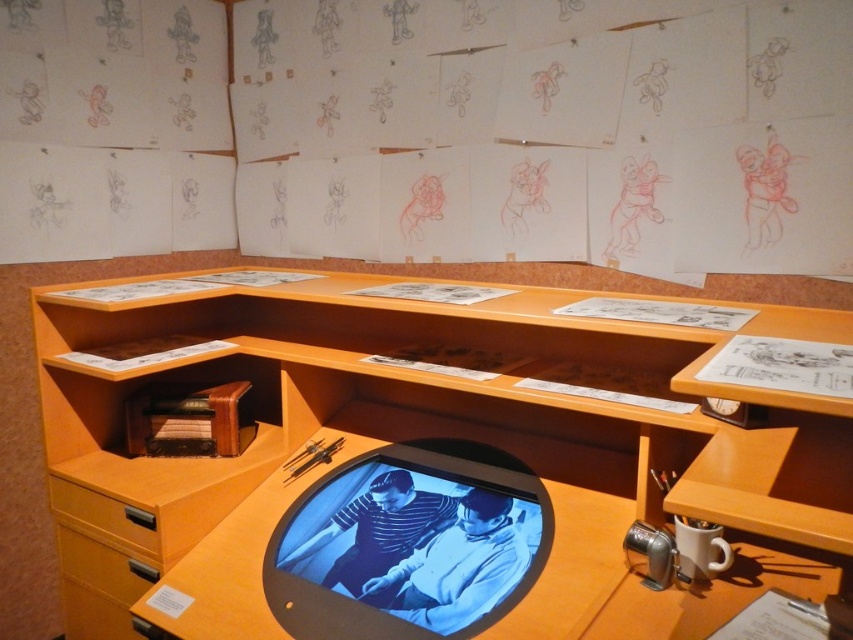
You are standing at the desk and need to reach both the point at coordinates point (392,492) and point (138,564). Which point is closer to you?

Point (392,492) is in front of point (138,564), so it is closer to you.

From the picture: You are organizing your workspace and need to place a 18 inch long cable between the matte wood shelf at center and the matte wood drawer at lower left. Will the cable fit without bending it?

The distance between the matte wood shelf at center and the matte wood drawer at lower left is 20.36 inches, which is longer than the 18 inch cable. Therefore, the cable can fit without bending.

Based on the provided scene description, where is the blue glossy computer monitor at center located in terms of its 2D coordinates?

The blue glossy computer monitor at center is located at the 2D coordinates point [403,548].